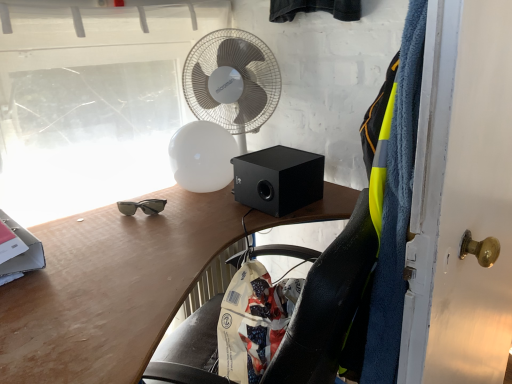
Identify the location of matte wood desk at center. (110, 288).

What do you see at coordinates (232, 81) in the screenshot? The height and width of the screenshot is (384, 512). I see `white plastic mechanical fan at upper center` at bounding box center [232, 81].

Where is `black matte speaker at center`? black matte speaker at center is located at coordinates coord(278,179).

Is matte wood desk at center placed right next to white painted wood door at right?

No, matte wood desk at center is not in contact with white painted wood door at right.

Does matte wood desk at center have a greater height compared to white painted wood door at right?

No.

Between matte wood desk at center and white painted wood door at right, which one appears on the left side from the viewer's perspective?

From the viewer's perspective, matte wood desk at center appears more on the left side.

Is white plastic mechanical fan at upper center oriented towards matte wood desk at center?

No, white plastic mechanical fan at upper center is not oriented towards matte wood desk at center.

Which is behind, point (206, 38) or point (245, 210)?

The point (206, 38) is farther from the camera.

Which object is thinner, white plastic mechanical fan at upper center or matte wood desk at center?

Thinner between the two is white plastic mechanical fan at upper center.

Considering the relative positions of white plastic mechanical fan at upper center and matte wood desk at center in the image provided, is white plastic mechanical fan at upper center to the left of matte wood desk at center from the viewer's perspective?

Yes.

Considering the sizes of black matte speaker at center and matte wood desk at center in the image, is black matte speaker at center bigger or smaller than matte wood desk at center?

In the image, black matte speaker at center appears to be smaller than matte wood desk at center.

From a real-world perspective, is black matte speaker at center on matte wood desk at center?

Yes, from a real-world perspective, black matte speaker at center is above matte wood desk at center.

Considering the sizes of black matte speaker at center and matte wood desk at center in the image, is black matte speaker at center wider or thinner than matte wood desk at center?

In the image, black matte speaker at center appears to be more narrow than matte wood desk at center.

Based on the photo, looking at the image, does black matte speaker at center seem bigger or smaller compared to white plastic mechanical fan at upper center?

Considering their sizes, black matte speaker at center takes up less space than white plastic mechanical fan at upper center.

Does point (307, 204) come farther from viewer compared to point (193, 89)?

No.

From the image's perspective, between black matte speaker at center and white plastic mechanical fan at upper center, which one is located above?

From the image's view, white plastic mechanical fan at upper center is above.

In the scene shown: Which of these two, black matte speaker at center or white plastic mechanical fan at upper center, stands taller?

With more height is white plastic mechanical fan at upper center.

Does white plastic mechanical fan at upper center have a larger size compared to black matte speaker at center?

Correct, white plastic mechanical fan at upper center is larger in size than black matte speaker at center.

Considering the sizes of objects white plastic mechanical fan at upper center and black matte speaker at center in the image provided, who is shorter, white plastic mechanical fan at upper center or black matte speaker at center?

With less height is black matte speaker at center.

From a real-world perspective, is white plastic mechanical fan at upper center physically above black matte speaker at center?

Indeed, from a real-world perspective, white plastic mechanical fan at upper center stands above black matte speaker at center.

How many degrees apart are the facing directions of white plastic mechanical fan at upper center and black matte speaker at center?

They differ by 33.2 degrees in their facing directions.

Does white plastic mechanical fan at upper center have a greater height compared to white painted wood door at right?

Incorrect, the height of white plastic mechanical fan at upper center is not larger of that of white painted wood door at right.

Would you say white plastic mechanical fan at upper center contains white painted wood door at right?

No, white painted wood door at right is not surrounded by white plastic mechanical fan at upper center.

Are white plastic mechanical fan at upper center and white painted wood door at right making contact?

No, white plastic mechanical fan at upper center is not with white painted wood door at right.

From the image's perspective, is white plastic mechanical fan at upper center positioned above or below white painted wood door at right?

Based on their image positions, white plastic mechanical fan at upper center is located above white painted wood door at right.

Considering the relative sizes of white painted wood door at right and white plastic mechanical fan at upper center in the image provided, is white painted wood door at right wider than white plastic mechanical fan at upper center?

In fact, white painted wood door at right might be narrower than white plastic mechanical fan at upper center.

Does point (504, 358) come in front of point (259, 40)?

Yes.

From a real-world perspective, is white painted wood door at right physically below white plastic mechanical fan at upper center?

Correct, in the physical world, white painted wood door at right is lower than white plastic mechanical fan at upper center.

Are white painted wood door at right and white plastic mechanical fan at upper center beside each other?

There is a gap between white painted wood door at right and white plastic mechanical fan at upper center.

Identify the location of desk located below the white painted wood door at right (from the image's perspective). Image resolution: width=512 pixels, height=384 pixels. (110, 288).

Locate an element on the screen. The image size is (512, 384). mechanical fan positioned vertically above the matte wood desk at center (from a real-world perspective) is located at coordinates (232, 81).

From the image, which object appears to be nearer to white painted wood door at right, black matte speaker at center or matte wood desk at center?

Based on the image, black matte speaker at center appears to be nearer to white painted wood door at right.

Which object lies further to the anchor point white painted wood door at right, black matte speaker at center or white plastic mechanical fan at upper center?

Based on the image, white plastic mechanical fan at upper center appears to be further to white painted wood door at right.

Considering their positions, is matte wood desk at center positioned further to black matte speaker at center than white plastic mechanical fan at upper center?

Among the two, white plastic mechanical fan at upper center is located further to black matte speaker at center.

Looking at the image, which one is located further to black matte speaker at center, white plastic mechanical fan at upper center or white painted wood door at right?

white painted wood door at right.

Estimate the real-world distances between objects in this image. Which object is closer to black matte speaker at center, white painted wood door at right or white plastic mechanical fan at upper center?

white plastic mechanical fan at upper center is closer to black matte speaker at center.

Looking at the image, which one is located closer to matte wood desk at center, white plastic mechanical fan at upper center or white painted wood door at right?

Based on the image, white plastic mechanical fan at upper center appears to be nearer to matte wood desk at center.

Looking at the image, which one is located further to white painted wood door at right, matte wood desk at center or white plastic mechanical fan at upper center?

white plastic mechanical fan at upper center is further to white painted wood door at right.

Estimate the real-world distances between objects in this image. Which object is further from matte wood desk at center, white plastic mechanical fan at upper center or black matte speaker at center?

Based on the image, white plastic mechanical fan at upper center appears to be further to matte wood desk at center.

The image size is (512, 384). Identify the location of desk located between white painted wood door at right and white plastic mechanical fan at upper center in the depth direction. (110, 288).

Identify the location of loudspeaker positioned between white painted wood door at right and white plastic mechanical fan at upper center from near to far. The image size is (512, 384). (278, 179).

Find the location of a particular element. This screenshot has height=384, width=512. loudspeaker between matte wood desk at center and white plastic mechanical fan at upper center along the z-axis is located at coordinates pos(278,179).

Locate an element on the screen. The width and height of the screenshot is (512, 384). desk located between white painted wood door at right and black matte speaker at center in the depth direction is located at coordinates (110, 288).